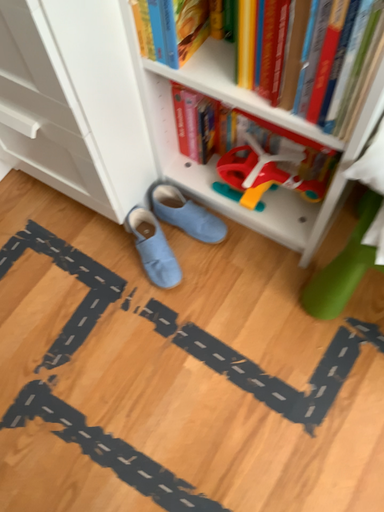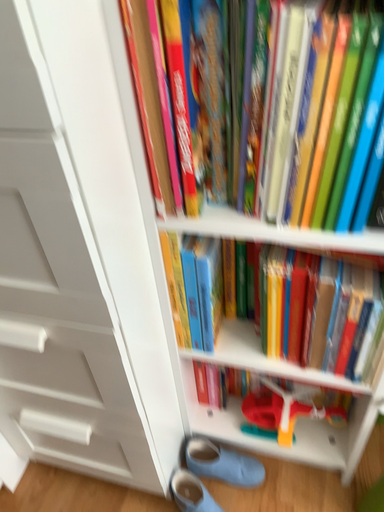
Question: Which way did the camera rotate in the video?

Choices:
 (A) rotated right
 (B) rotated left

Answer: (A)